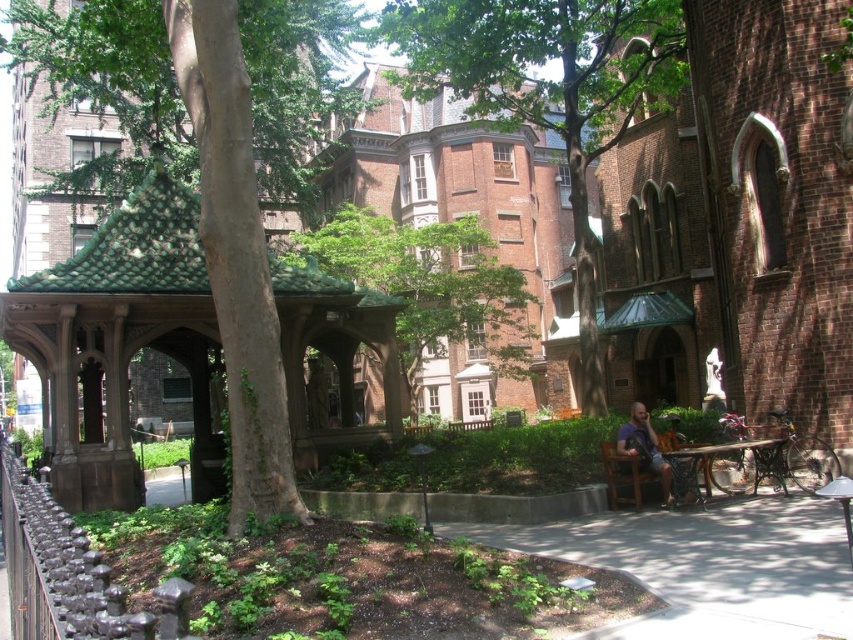
Question: Can you confirm if dark blue shirt at center is positioned below wooden picnic table at lower right?

Choices:
 (A) no
 (B) yes

Answer: (B)

Question: Which is nearer to the green textured gazebo at center?

Choices:
 (A) green tile gazebo at left
 (B) wooden picnic table at lower right
 (C) green leafy tree at center

Answer: (A)

Question: Which point is farther from the camera taking this photo?

Choices:
 (A) (498, 83)
 (B) (431, 256)
 (C) (708, 470)
 (D) (151, 224)

Answer: (B)

Question: Does green leafy tree at center have a greater width compared to green textured gazebo at center?

Choices:
 (A) no
 (B) yes

Answer: (A)

Question: Which of the following is the farthest from the observer?

Choices:
 (A) dark blue shirt at center
 (B) green textured gazebo at center

Answer: (B)

Question: Is green textured gazebo at center in front of dark blue shirt at center?

Choices:
 (A) no
 (B) yes

Answer: (A)